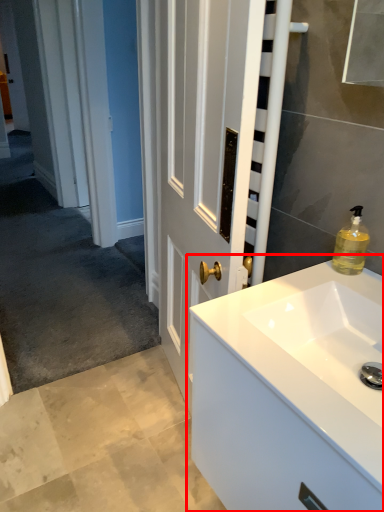
Question: In this image, where is bathroom cabinet (annotated by the red box) located relative to soap dispenser?

Choices:
 (A) left
 (B) right

Answer: (A)